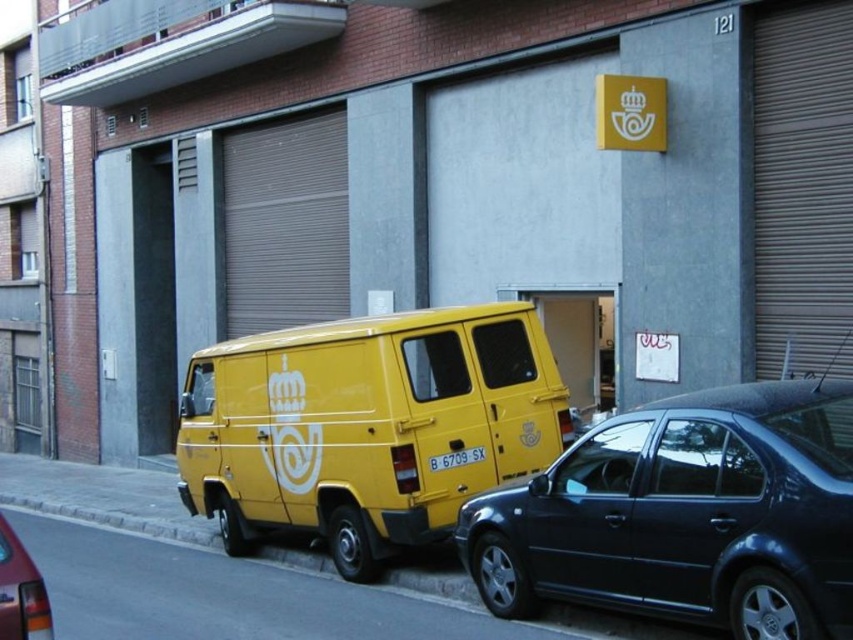
Which is below, metallic dark blue sedan at center or yellow matte van at center?

metallic dark blue sedan at center

Which of these two, metallic dark blue sedan at center or yellow matte van at center, stands shorter?

With less height is metallic dark blue sedan at center.

Looking at this image, who is more forward, (798, 609) or (419, 458)?

Point (798, 609) is more forward.

What are the coordinates of `metallic dark blue sedan at center` in the screenshot? It's located at (686, 515).

Is yellow matte van at center to the right of yellow matte license plate at center from the viewer's perspective?

In fact, yellow matte van at center is to the left of yellow matte license plate at center.

Who is more distant from viewer, (502,339) or (456,464)?

Point (502,339)

Where is `yellow matte van at center`? The width and height of the screenshot is (853, 640). yellow matte van at center is located at coordinates (366, 426).

Who is taller, metallic dark blue sedan at center or shiny red tail light at lower left?

With more height is metallic dark blue sedan at center.

Which is in front, point (563, 502) or point (15, 531)?

Point (563, 502) is more forward.

Is point (596, 452) in front of point (28, 584)?

That is False.

Where is `metallic dark blue sedan at center`? The width and height of the screenshot is (853, 640). metallic dark blue sedan at center is located at coordinates (686, 515).